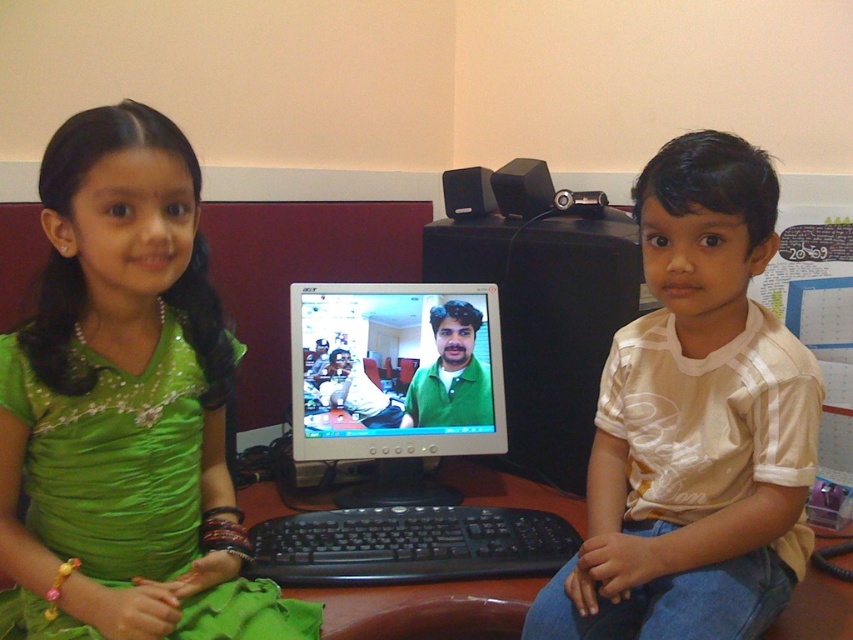
Is green satin dress at left below black plastic keyboard at center?

No, green satin dress at left is not below black plastic keyboard at center.

Who is more distant from viewer, [1,400] or [448,532]?

Positioned behind is point [448,532].

What do you see at coordinates (126, 404) in the screenshot? The height and width of the screenshot is (640, 853). I see `green satin dress at left` at bounding box center [126, 404].

Image resolution: width=853 pixels, height=640 pixels. In order to click on green satin dress at left in this screenshot , I will do `click(126, 404)`.

Can you confirm if white striped t-shirt at center is thinner than matte black monitor at center?

In fact, white striped t-shirt at center might be wider than matte black monitor at center.

What do you see at coordinates (695, 422) in the screenshot? I see `white striped t-shirt at center` at bounding box center [695, 422].

Find the location of a particular element. white striped t-shirt at center is located at coordinates (695, 422).

Describe the element at coordinates (395, 381) in the screenshot. I see `matte black monitor at center` at that location.

What do you see at coordinates (395, 381) in the screenshot? I see `matte black monitor at center` at bounding box center [395, 381].

You are a GUI agent. You are given a task and a screenshot of the screen. Output one action in this format:
    pyautogui.click(x=<x>, y=<y>)
    Task: Click on the matte black monitor at center
    
    Given the screenshot: What is the action you would take?
    (395, 381)